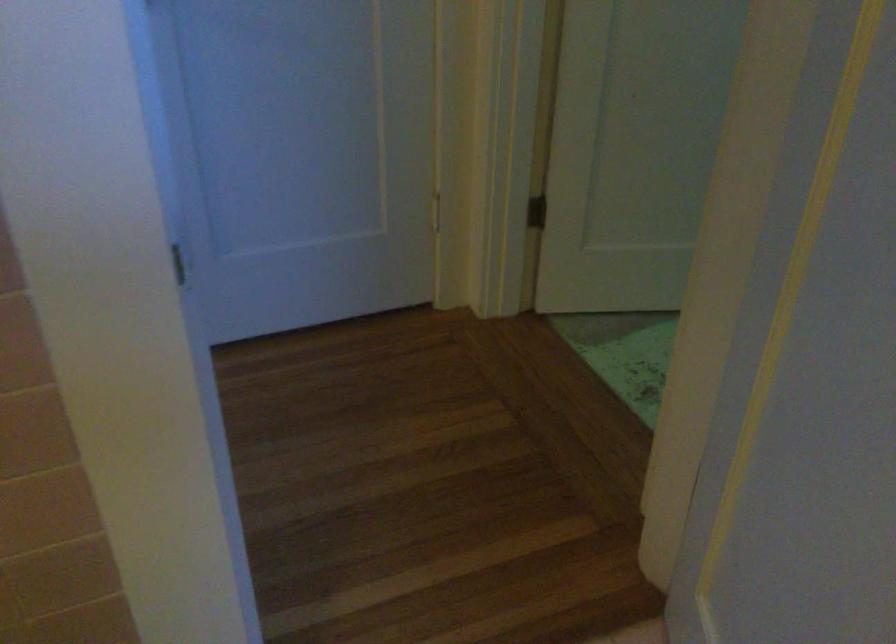
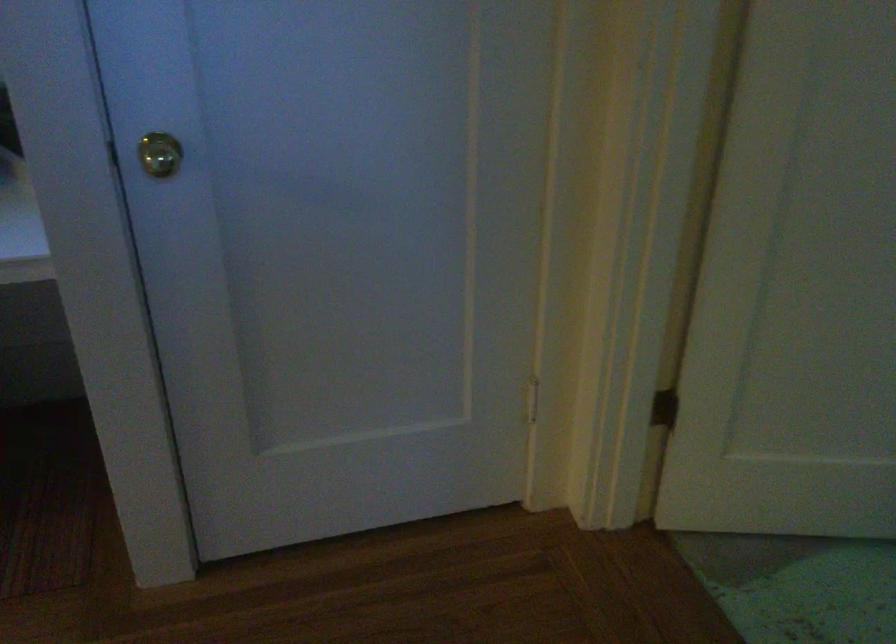
Question: How did the camera likely rotate?

Choices:
 (A) Left
 (B) Right
 (C) Up
 (D) Down

Answer: (A)